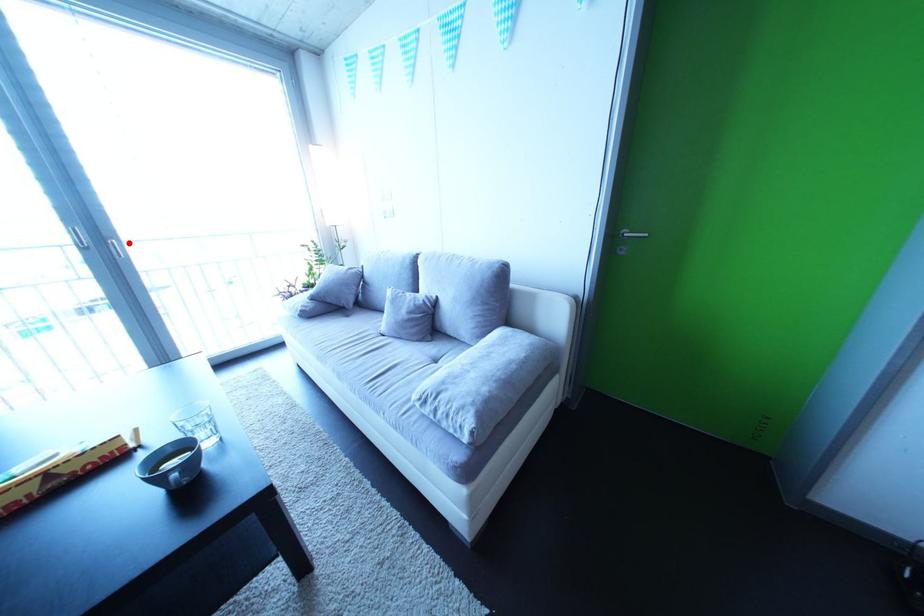
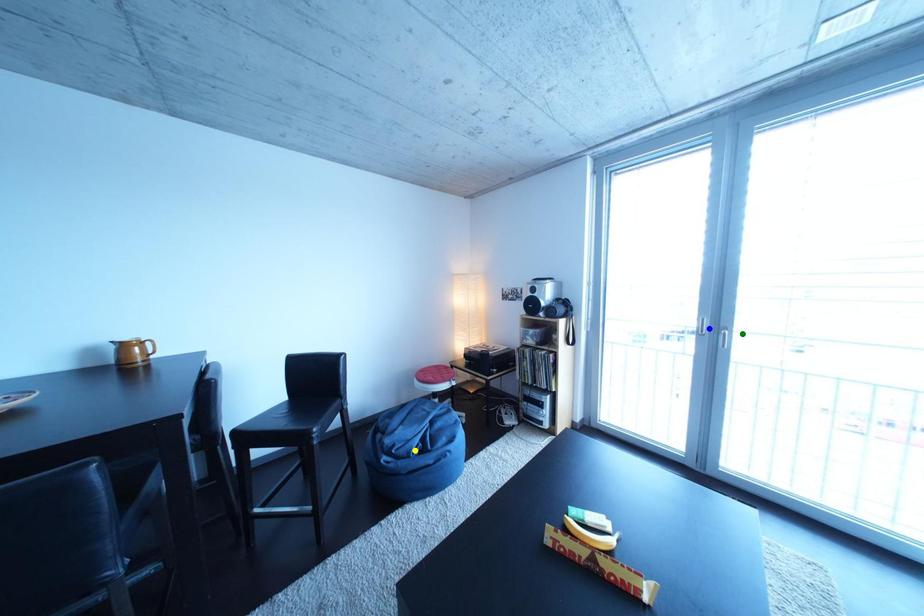
Question: I am providing you with two images of the same scene from different viewpoints. A red point is marked on the first image. You are given multiple points on the second image. Can you choose the point in image 2 that corresponds to the point in image 1?

Choices:
 (A) yellow point
 (B) green point
 (C) blue point

Answer: (B)